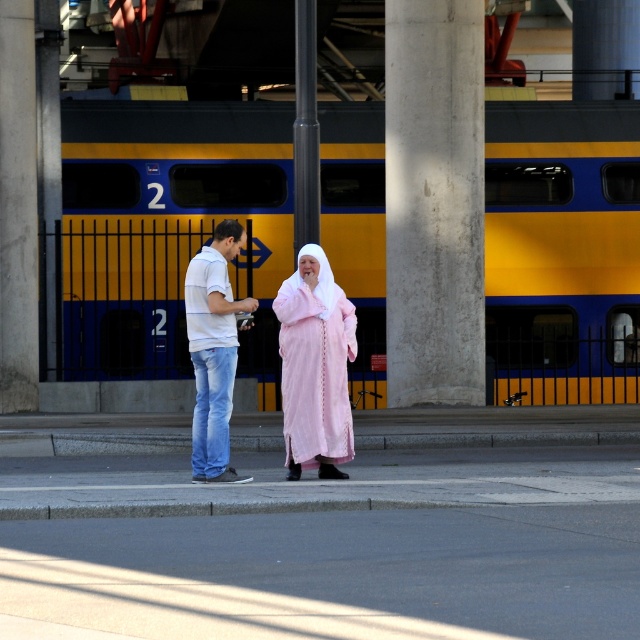
You are standing at point [381,218] and want to reach the train at the platform. The train is 28.34 meters away from you. If you can walk at 1.5 meters per second, how many seconds will it take you to reach the train?

The distance between you and the train is 28.34 meters. At a walking speed of 1.5 meters per second, dividing the distance by the speed gives approximately 18.89 seconds. Therefore, it will take about 19 seconds to reach the train.

In the scene shown: You are standing on the train platform and want to board the yellow metallic train at center. The platform has a specific boarding point marked at coordinate point (168, 228). Is this point the correct location to board the yellow metallic train at center?

Yes, the point (168, 228) corresponds to the yellow metallic train at center, so this is the correct boarding location.